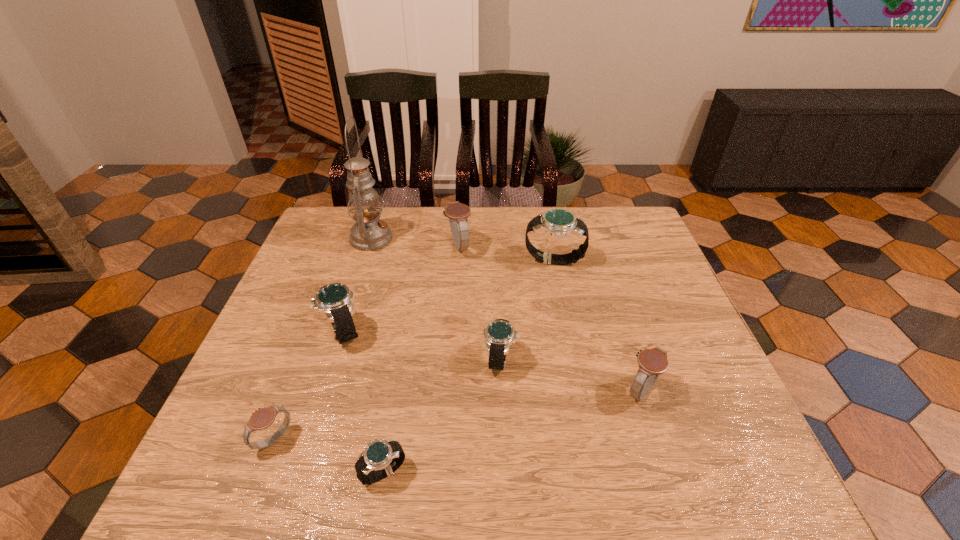
Image resolution: width=960 pixels, height=540 pixels. I want to click on vacant space located on the right of the third biggest silver watch, so click(667, 360).

Where is `free space located on the right of the nearest gray watch`? The width and height of the screenshot is (960, 540). free space located on the right of the nearest gray watch is located at coordinates (382, 440).

This screenshot has height=540, width=960. Identify the location of vacant region located on the back of the smallest silver watch. (400, 371).

Where is `oil lamp at the far edge`? The width and height of the screenshot is (960, 540). oil lamp at the far edge is located at coordinates (369, 233).

This screenshot has width=960, height=540. In order to click on oil lamp located in the left edge section of the desktop in this screenshot , I will do `click(369, 233)`.

Where is `object that is positioned at the right edge`? This screenshot has height=540, width=960. object that is positioned at the right edge is located at coordinates [652, 362].

Locate an element on the screen. The height and width of the screenshot is (540, 960). object located at the far left corner is located at coordinates (369, 233).

This screenshot has height=540, width=960. Identify the location of object located at the near left corner. (262, 418).

In the image, there is a desktop. Identify the location of free space at the far edge. (393, 223).

The width and height of the screenshot is (960, 540). In the image, there is a desktop. Identify the location of vacant space at the near edge. (512, 457).